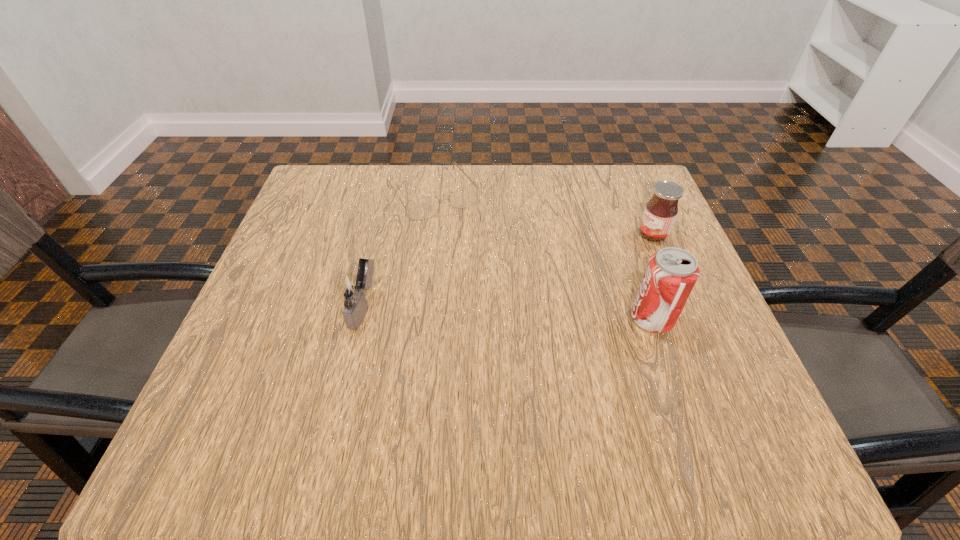
You are a GUI agent. You are given a task and a screenshot of the screen. Output one action in this format:
    pyautogui.click(x=<x>, y=<y>)
    Task: Click on the vacant space on the desktop that is between the igniter and the tallest object and is positioned on the front-facing side of the farthest object
    This screenshot has height=540, width=960.
    Given the screenshot: What is the action you would take?
    pyautogui.click(x=514, y=313)

Locate an element on the screen. This screenshot has width=960, height=540. vacant space on the desktop that is between the igniter and the soda can and is positioned on the label side of the jam is located at coordinates (x=465, y=311).